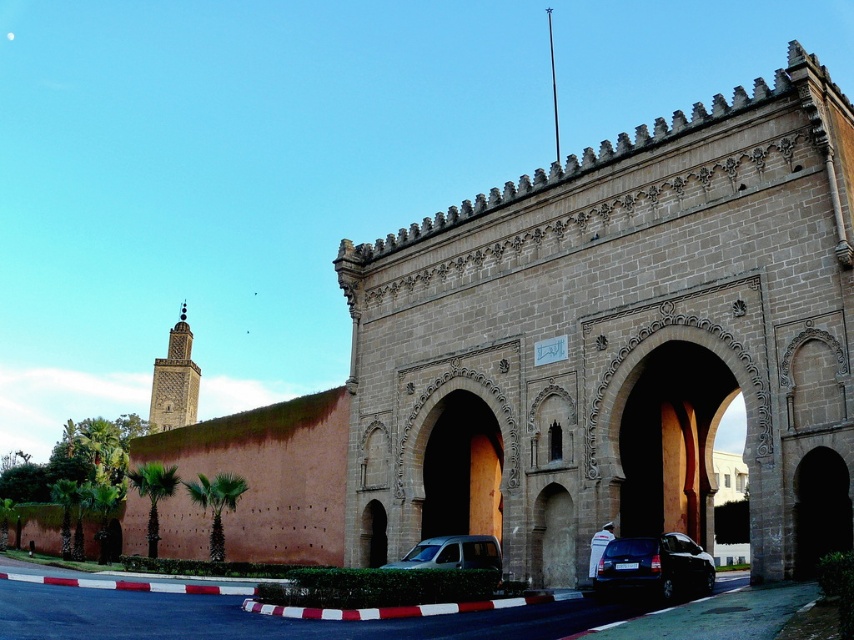
You are standing in front of the grand architectural structure described. You see a point marked at coordinates (x=654, y=566). What object is located at that point?

The point at coordinates (x=654, y=566) indicates a shiny black sedan at lower center.

You are driving a shiny black sedan at lower center and want to exit the parking lot. The exit is located at point 0.9, 0.8. Can you reach the exit without moving sideways?

The shiny black sedan at lower center is located at point (654, 566). The exit is at (682, 576). Since the coordinates are close, the sedan can likely reach the exit without moving sideways by driving straight forward.